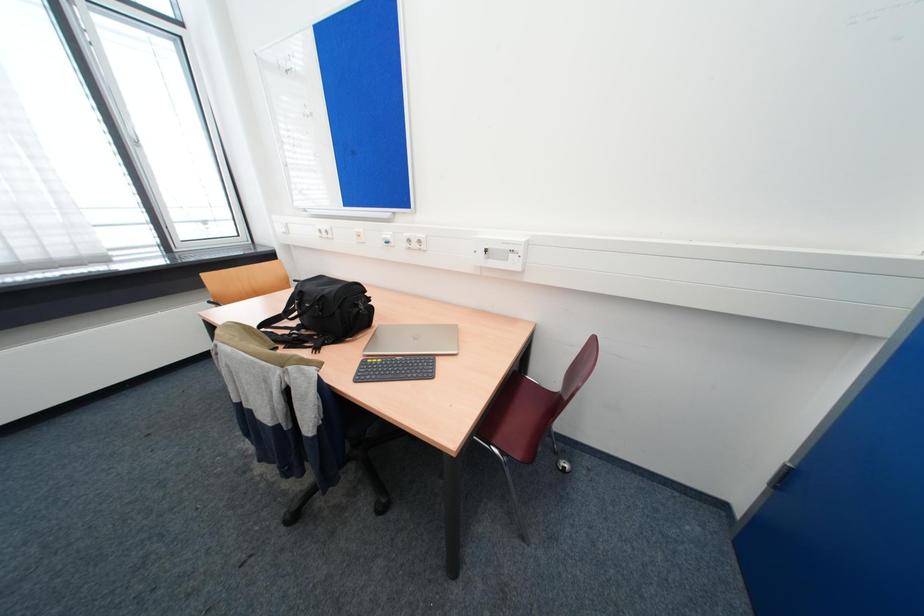
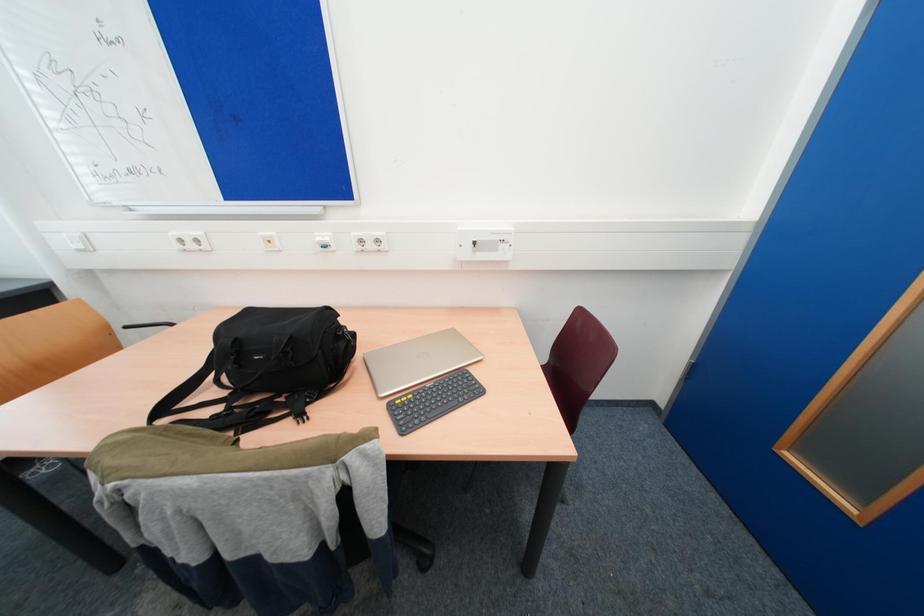
Question: The camera is either moving clockwise (left) or counter-clockwise (right) around the object. The first image is from the beginning of the video and the second image is from the end. Is the camera moving left or right when shooting the video?

Choices:
 (A) Left
 (B) Right

Answer: (A)